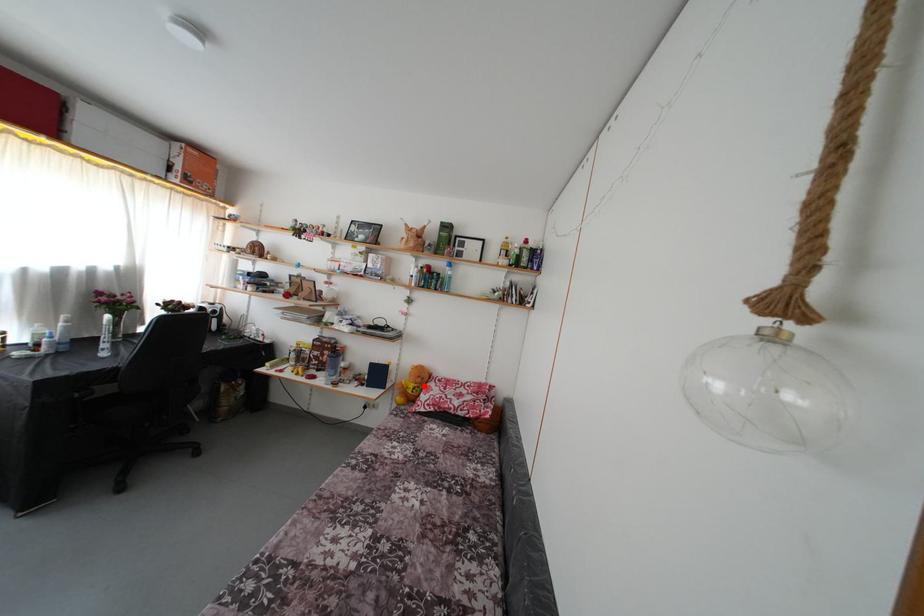
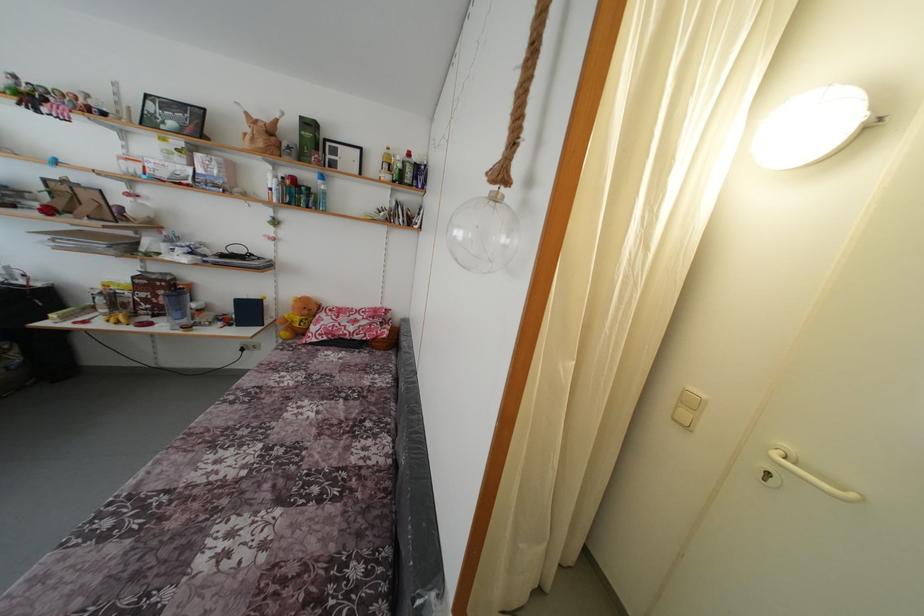
In the second image, find the point that corresponds to the highlighted location in the first image.

(310, 317)